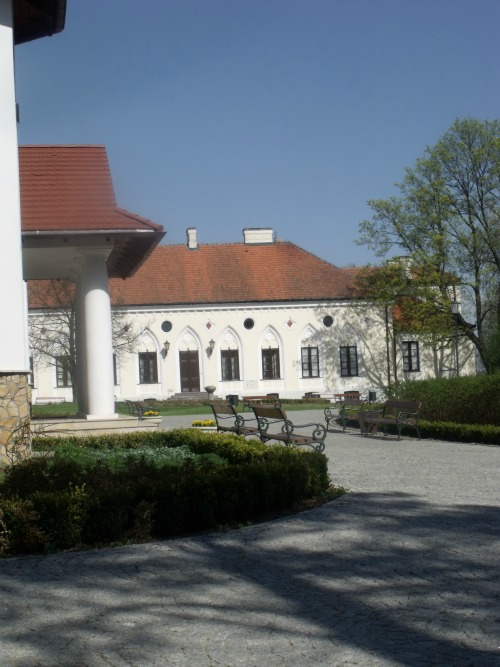
Where is `door`? door is located at coordinates tap(191, 365).